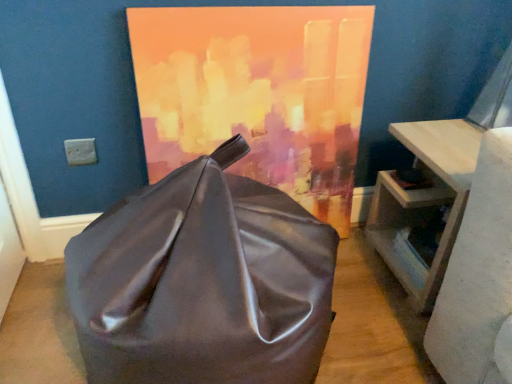
Question: In terms of height, does light wood table at right look taller or shorter compared to shiny brown bean bag at center?

Choices:
 (A) tall
 (B) short

Answer: (B)

Question: From a real-world perspective, is light wood table at right positioned above or below shiny brown bean bag at center?

Choices:
 (A) above
 (B) below

Answer: (B)

Question: Based on their relative distances, which object is nearer to the light wood table at right?

Choices:
 (A) shiny brown bean bag at center
 (B) matte acrylic painting at center

Answer: (B)

Question: Which object is the closest to the shiny brown bean bag at center?

Choices:
 (A) matte acrylic painting at center
 (B) light wood table at right

Answer: (A)